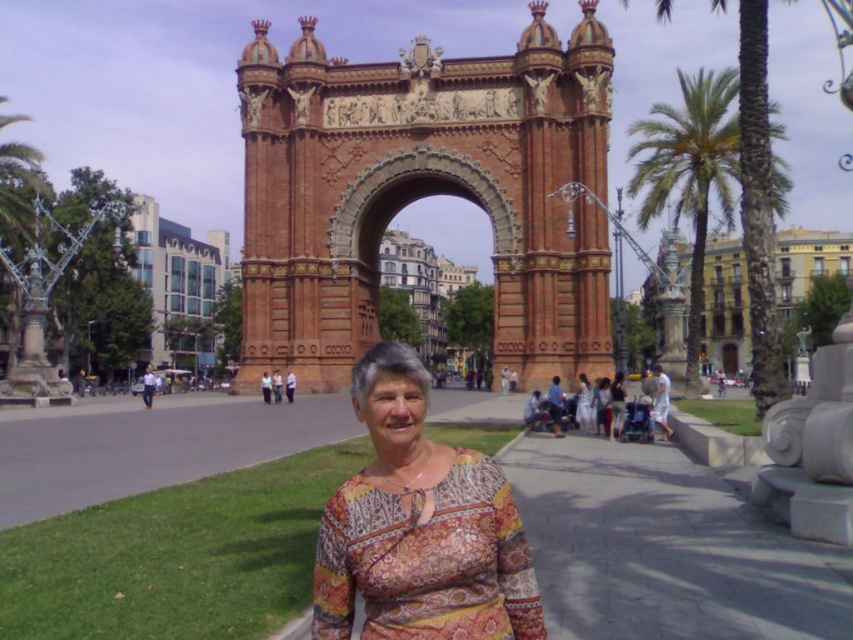
Question: Does brown brick arch at center appear over green leafy palm tree at left?

Choices:
 (A) yes
 (B) no

Answer: (A)

Question: Which of the following is the closest to the observer?

Choices:
 (A) printed cotton blouse at center
 (B) green leafy palm tree at left

Answer: (A)

Question: Can you confirm if brown brick arch at center is positioned to the left of green leafy palm tree at left?

Choices:
 (A) no
 (B) yes

Answer: (A)

Question: Can you confirm if brown brick arch at center is wider than printed fabric blouse at center?

Choices:
 (A) no
 (B) yes

Answer: (B)

Question: Which point appears farthest from the camera in this image?

Choices:
 (A) (612, 401)
 (B) (347, 106)
 (C) (778, 196)

Answer: (B)

Question: Which of the following is the closest to the observer?

Choices:
 (A) printed cotton blouse at center
 (B) green leafy palm tree at left

Answer: (A)